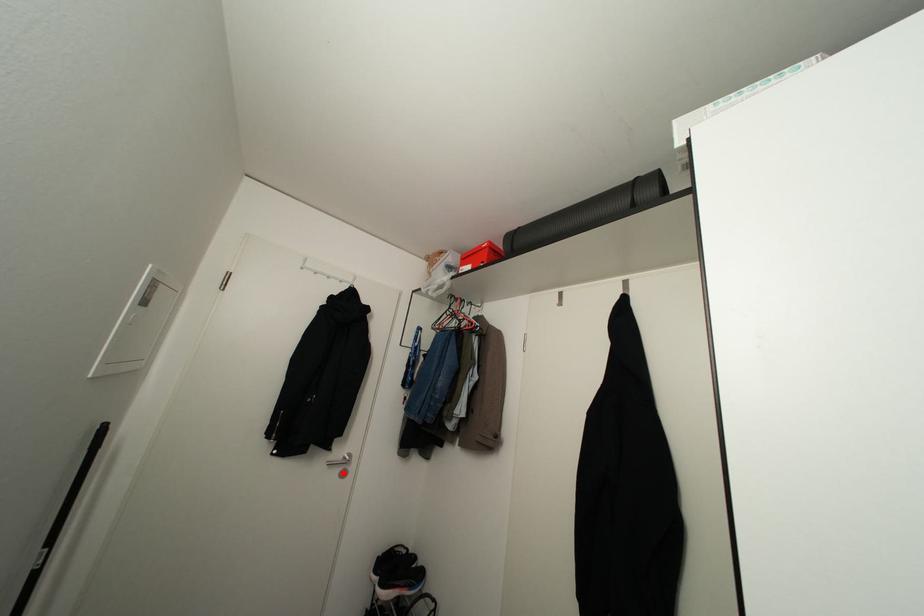
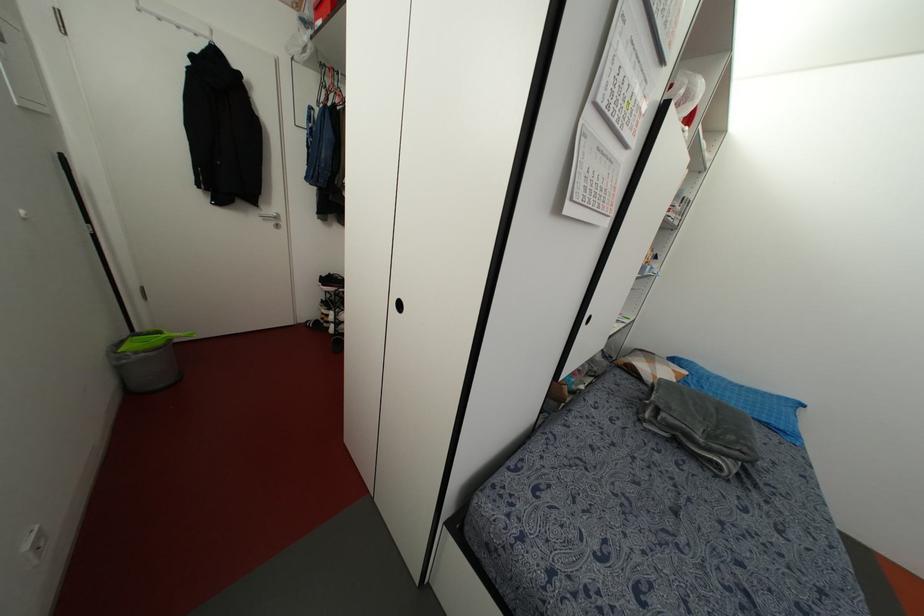
Locate, in the second image, the point that corresponds to the highlighted location in the first image.

(276, 225)